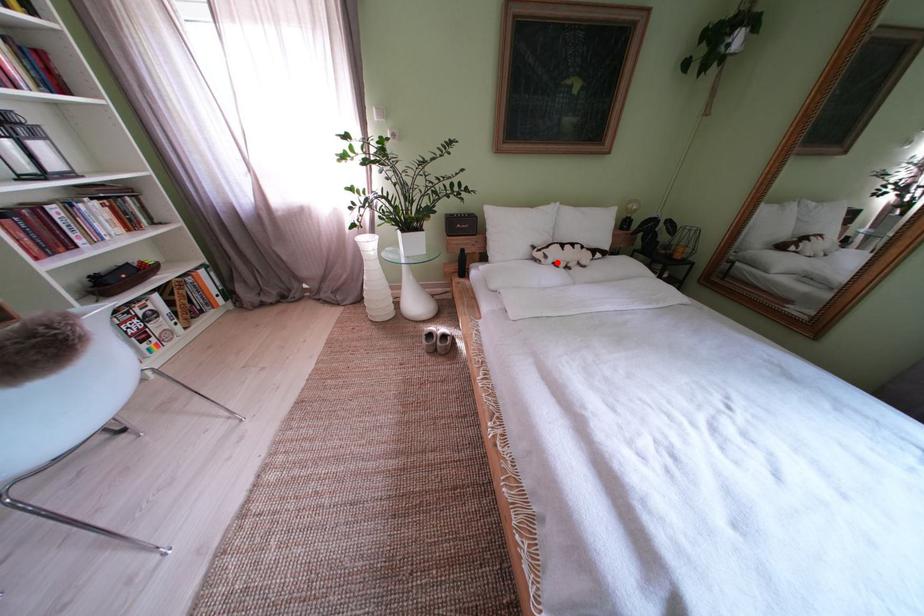
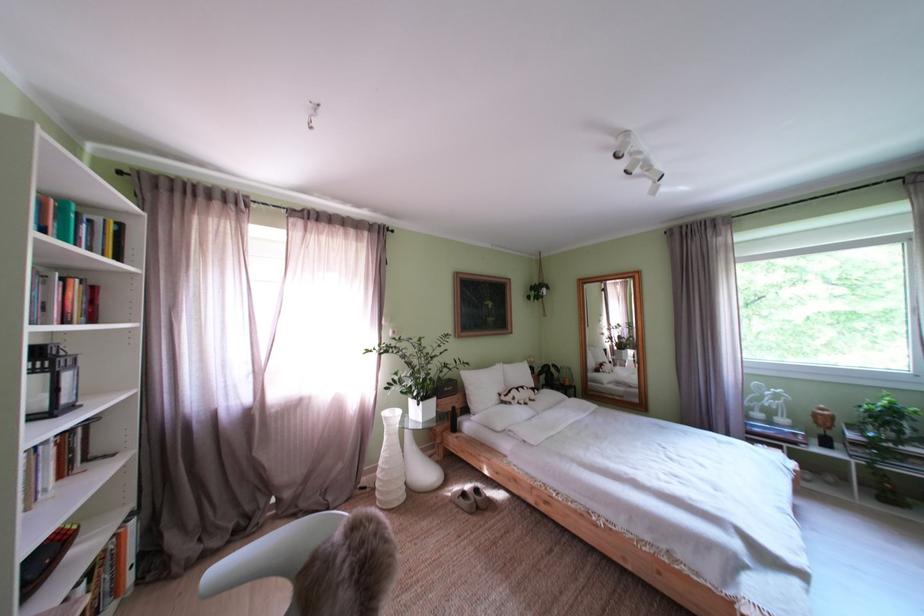
Question: I am providing you with two images of the same scene from different viewpoints. In image1, a red point is highlighted. Considering the same 3D point in image2, which of the following is correct?

Choices:
 (A) It is closer
 (B) It is farther

Answer: (B)